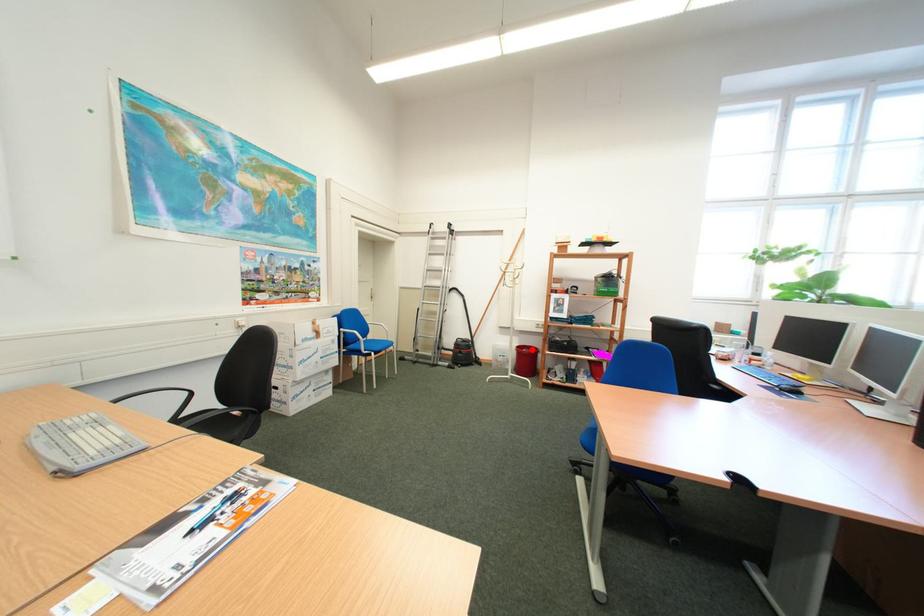
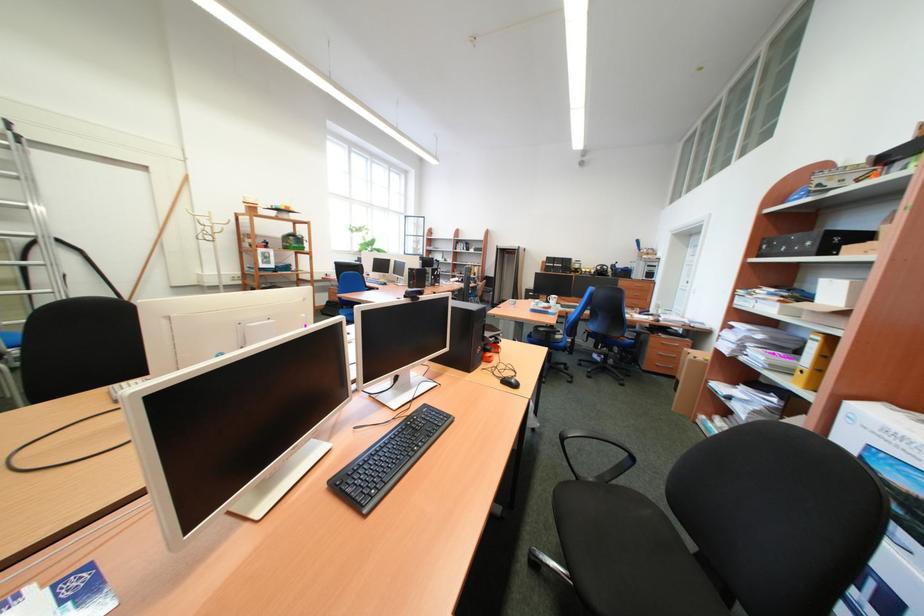
Question: I am providing you with two images of the same scene from different viewpoints. A red point is marked on the first image. At the location where the point appears in image 1, is it still visible in image 2?

Choices:
 (A) Yes
 (B) No

Answer: (B)